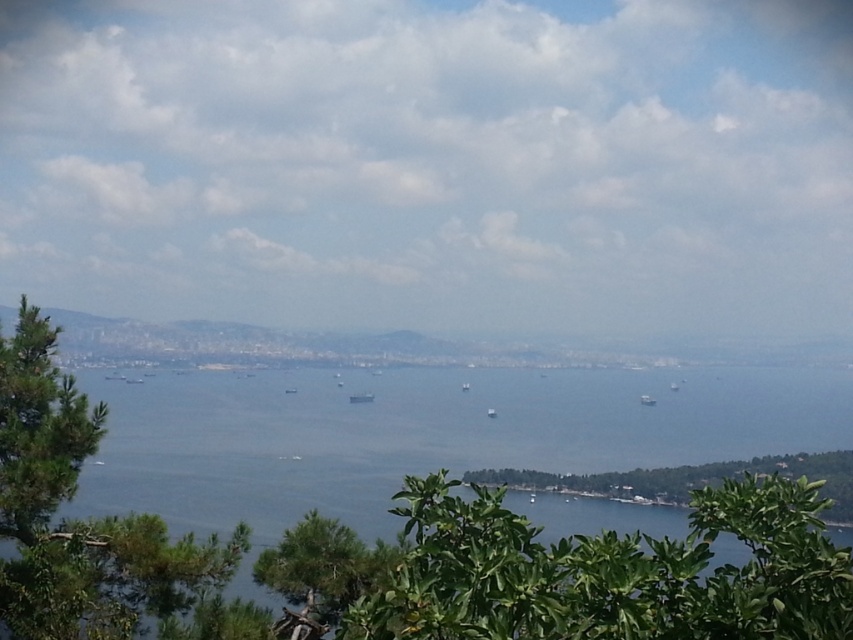
You are standing at the edge of the coastal landscape and want to reach a specific point marked at coordinates point (123, 625). If your maximum walking distance is 20 meters, can you reach that point without exceeding your limit?

The distance of point (123, 625) from viewer is 19.83 meters, so yes, you can reach it since it is within your 20 meters limit.

You are standing at the point marked by coordinates point (422, 435). Looking around, you see the blue water at center and the distant cityscape in the background. Which direction should you face to see the blue water at center?

You should face towards the center direction because the blue water at center is located at the center point marked by point (422, 435).